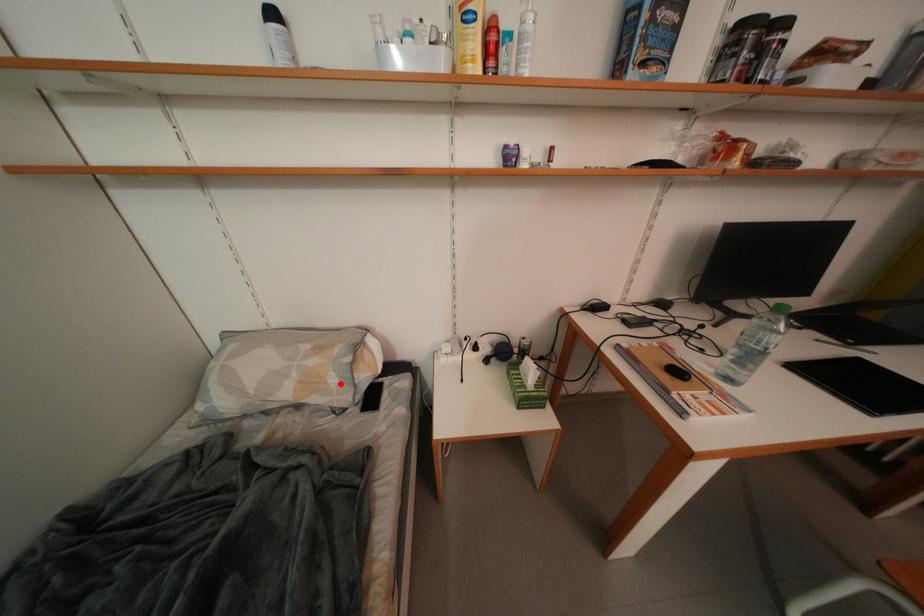
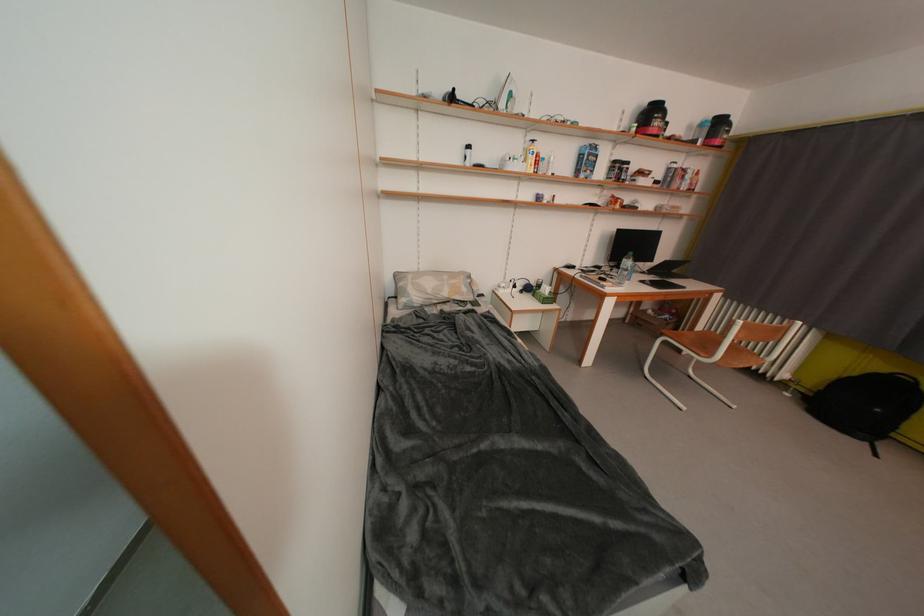
Question: I am providing you with two images of the same scene from different viewpoints. A red point is shown in image1. For the corresponding object point in image2, is it positioned nearer or farther from the camera?

Choices:
 (A) Nearer
 (B) Farther

Answer: (A)